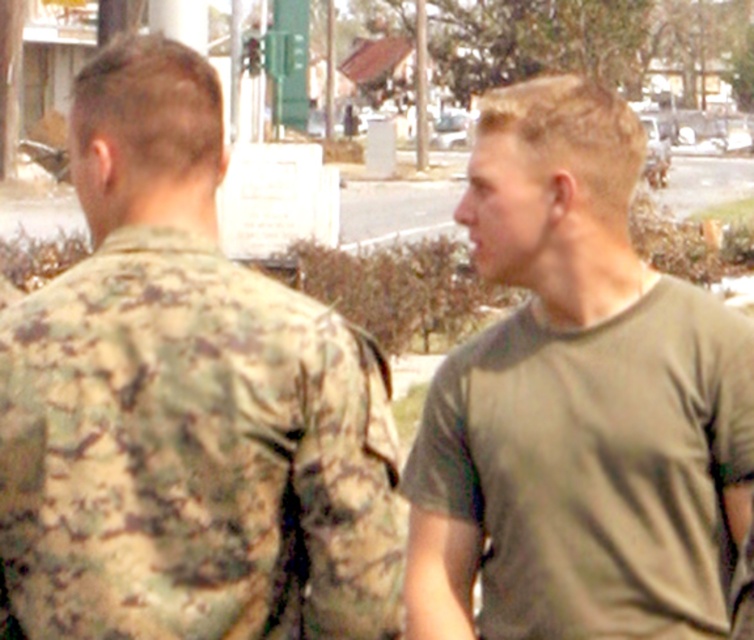
Question: Which point is farther to the camera?

Choices:
 (A) (262, 356)
 (B) (535, 342)

Answer: (B)

Question: Observing the image, what is the correct spatial positioning of camouflage uniform at back in reference to olive green t-shirt at right?

Choices:
 (A) above
 (B) below

Answer: (B)

Question: Which object is closer to the camera taking this photo?

Choices:
 (A) camouflage uniform at back
 (B) olive green t-shirt at right

Answer: (A)

Question: Which point is farther to the camera?

Choices:
 (A) (661, 500)
 (B) (136, 45)

Answer: (A)

Question: Does camouflage uniform at back have a larger size compared to olive green t-shirt at right?

Choices:
 (A) yes
 (B) no

Answer: (A)

Question: Observing the image, what is the correct spatial positioning of camouflage uniform at back in reference to olive green t-shirt at right?

Choices:
 (A) left
 (B) right

Answer: (A)